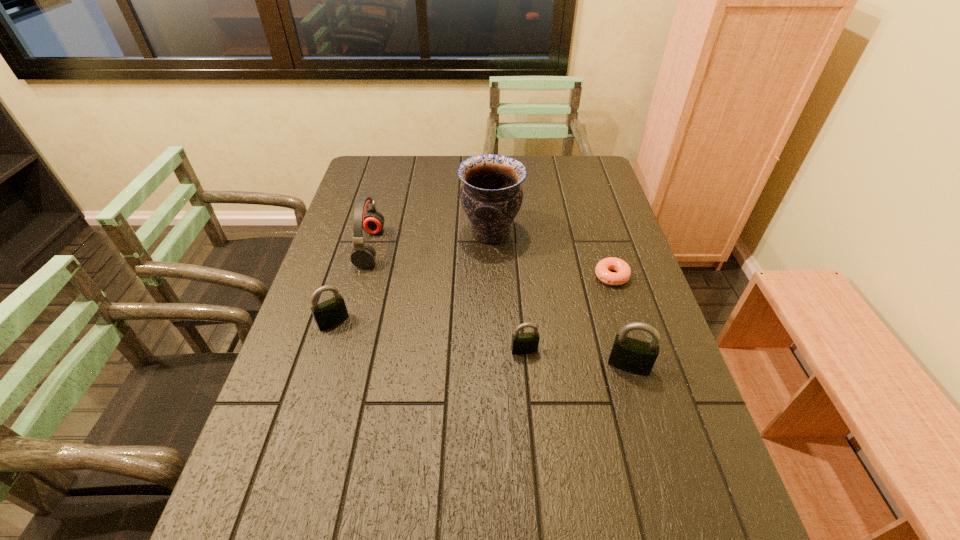
Identify the location of doughnut that is at the right edge. This screenshot has height=540, width=960. (622, 268).

Where is `vacant space at the far edge`? vacant space at the far edge is located at coordinates (441, 156).

Where is `vacant space at the near edge`? This screenshot has width=960, height=540. vacant space at the near edge is located at coordinates (468, 462).

This screenshot has width=960, height=540. Find the location of `vacant space at the left edge of the desktop`. vacant space at the left edge of the desktop is located at coordinates (281, 431).

This screenshot has height=540, width=960. In the image, there is a desktop. What are the coordinates of `vacant space at the right edge` in the screenshot? It's located at (617, 211).

The image size is (960, 540). Find the location of `vacant space at the far left corner of the desktop`. vacant space at the far left corner of the desktop is located at coordinates (373, 158).

Find the location of a particular element. The height and width of the screenshot is (540, 960). free space at the near right corner is located at coordinates (694, 457).

Locate an element on the screen. The height and width of the screenshot is (540, 960). free space between the earphone and the tallest padlock is located at coordinates coord(499,307).

Locate an element on the screen. unoccupied area between the earphone and the fourth farthest object is located at coordinates (351, 285).

This screenshot has width=960, height=540. What are the coordinates of `unoccupied position between the doughnut and the second nearest object` in the screenshot? It's located at (568, 313).